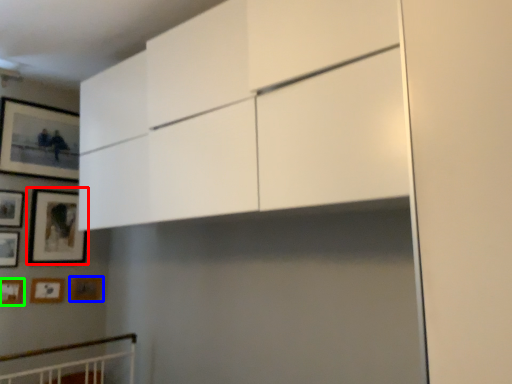
Question: Which object is the closest to the picture frame (highlighted by a red box)? Choose among these: picture frame (highlighted by a blue box) or picture frame (highlighted by a green box).

Choices:
 (A) picture frame
 (B) picture frame

Answer: (A)